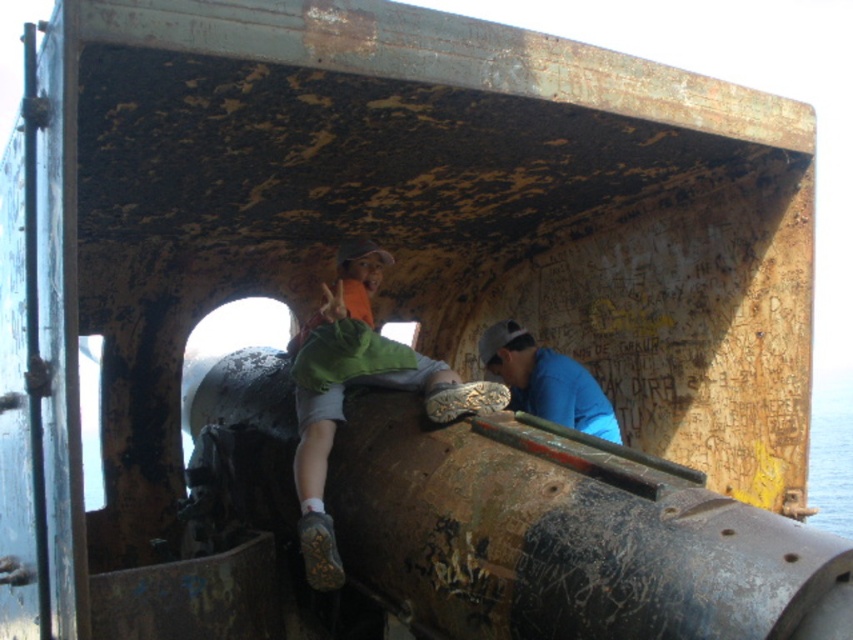
Between green fabric shirt at center and blue matte shirt at center, which one is positioned lower?

blue matte shirt at center is below.

Is point (450, 380) farther from camera compared to point (521, 378)?

That is False.

Identify the location of green fabric shirt at center. (357, 384).